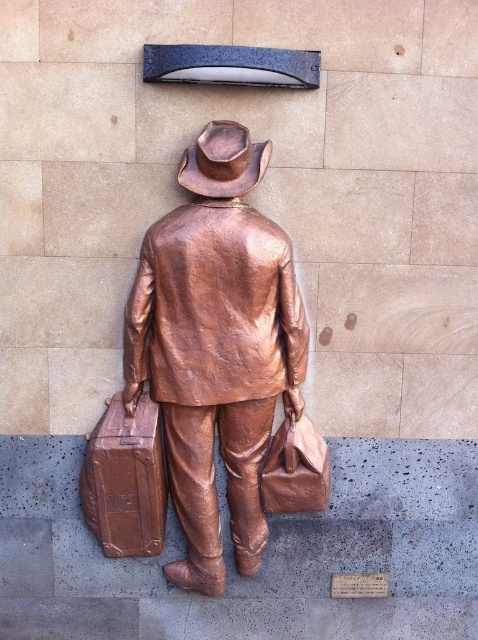
In the scene shown: You are standing in front of the bronze statue at center and want to pick up the shiny brown suitcase at lower left. Can you reach it without moving your position?

The bronze statue at center is closer to the viewer than the shiny brown suitcase at lower left, so you cannot reach the shiny brown suitcase at lower left without moving your position because it is farther away.